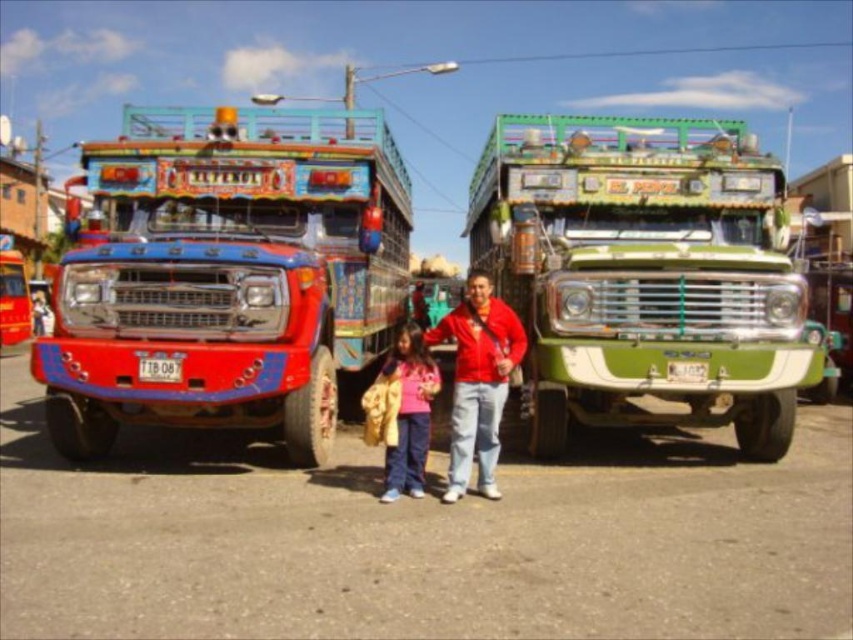
Question: Which point appears farthest from the camera in this image?

Choices:
 (A) (727, 289)
 (B) (260, 209)
 (C) (415, 496)

Answer: (B)

Question: Which of these objects is positioned farthest from the red matte jacket at center?

Choices:
 (A) shiny red truck at left
 (B) green matte truck at center
 (C) matte pink shirt at center

Answer: (A)

Question: Can you confirm if red matte jacket at center is positioned above matte pink shirt at center?

Choices:
 (A) yes
 (B) no

Answer: (A)

Question: Is green matte truck at center further to the viewer compared to matte pink shirt at center?

Choices:
 (A) no
 (B) yes

Answer: (B)

Question: Estimate the real-world distances between objects in this image. Which object is farther from the matte pink shirt at center?

Choices:
 (A) green matte truck at center
 (B) shiny red truck at left
 (C) red matte jacket at center

Answer: (B)

Question: Is shiny red truck at left behind green matte truck at center?

Choices:
 (A) yes
 (B) no

Answer: (B)